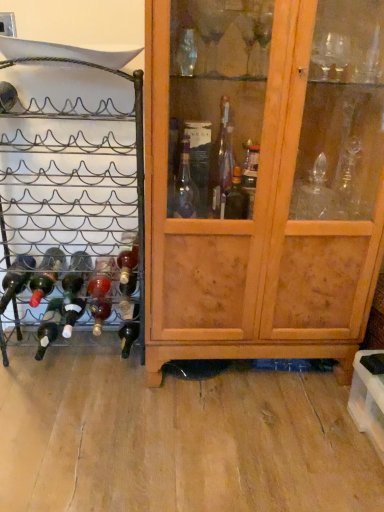
Locate an element on the screen. This screenshot has height=512, width=384. free space in front of dark glass bottle at lower left, which is the sixth bottle in left-to-right order is located at coordinates (x=123, y=381).